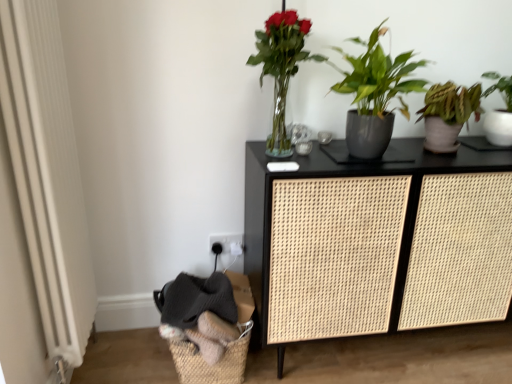
Question: From the image's perspective, is black rattan cabinet at center located above or below white textured radiator at left?

Choices:
 (A) below
 (B) above

Answer: (A)

Question: Is black rattan cabinet at center in front of or behind white textured radiator at left in the image?

Choices:
 (A) front
 (B) behind

Answer: (B)

Question: Which is farther from the matte gray pot at center right, which is counted as the 2th houseplant, starting from the left?

Choices:
 (A) black rattan cabinet at center
 (B) white textured radiator at left
 (C) green matte plant at right, which appears as the third houseplant when viewed from the left
 (D) woven natural basket at lower left
 (E) translucent glass vase at upper center, which ranks as the first houseplant in left-to-right order

Answer: (B)

Question: Which of these objects is positioned farthest from the woven natural basket at lower left?

Choices:
 (A) translucent glass vase at upper center, which is counted as the third houseplant, starting from the right
 (B) white textured radiator at left
 (C) black rattan cabinet at center
 (D) green matte plant at right, which appears as the third houseplant when viewed from the left
 (E) matte gray pot at center right, which is counted as the 2th houseplant, starting from the left

Answer: (D)